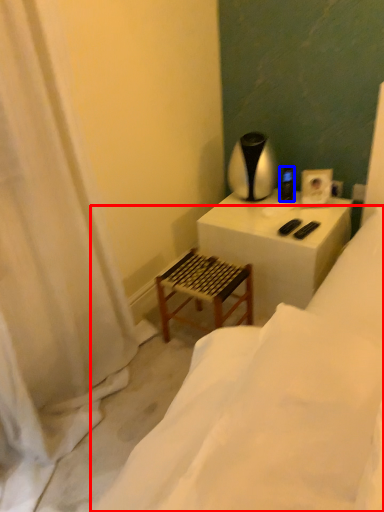
Question: Which of the following is the farthest to the observer, furniture (highlighted by a red box) or appliance (highlighted by a blue box)?

Choices:
 (A) furniture
 (B) appliance

Answer: (B)